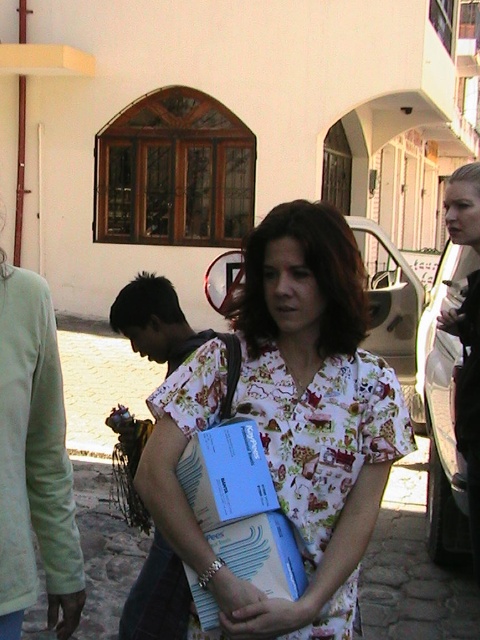
You are a photographer trying to capture the woman in the floral fabric dress at center and the individual in the floral fabric shirt at center. Which one should you focus on first if you want to photograph them in order from left to right?

The floral fabric shirt at center is to the left of the floral fabric dress at center, so you should focus on the floral fabric shirt at center first.

You are standing in the residential area shown in the image. You see a woman holding two packages wrapped in blue paper with white text. Where is the floral fabric dress at center located in relation to the woman?

The floral fabric dress at center is located at point [290,422], which is to the right and slightly below the woman holding the packages.